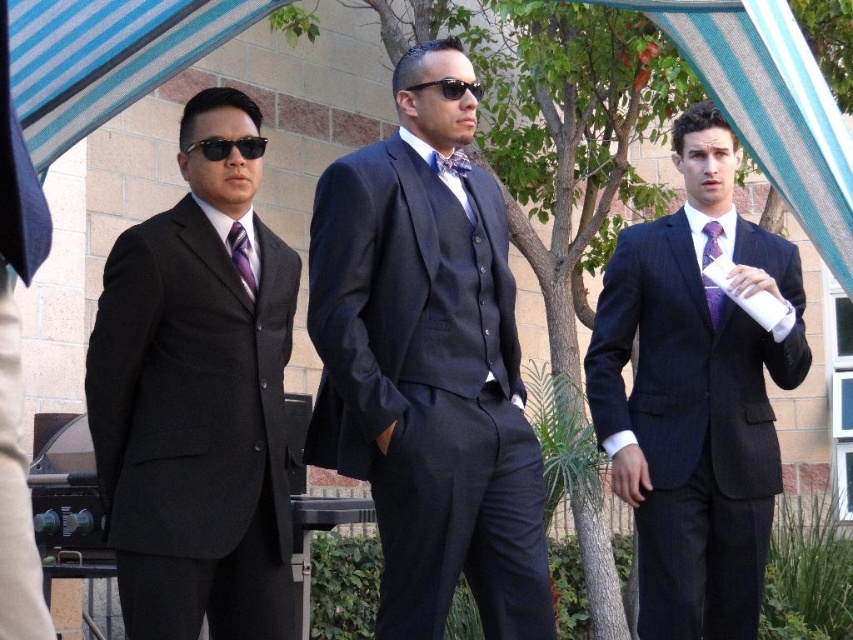
You are a photographer trying to capture a clear shot of the matte black suit at left and the black reflective sunglasses at left. Since you want to focus on both, which object should you adjust your camera focus on first to ensure clarity?

The matte black suit at left is closer to the viewer than the black reflective sunglasses at left, so you should focus on the matte black suit at left first to ensure both are in focus.

Based on the scene description, where is the matte black suit at left located in terms of coordinates?

The matte black suit at left is located at point (196,401).

You are a photographer trying to capture a group photo of the three men under the blue and white striped canopy. Since the matte black suit at left and the black reflective sunglasses at left are part of the scene, which one would you need to adjust your camera angle for to avoid glare from the sun? Explain your reasoning.

The black reflective sunglasses at left would cause more glare and require adjusting the camera angle because reflective surfaces like sunglasses can produce strong reflections, whereas the matte black suit at left, being non reflective, would not create the same level of glare.